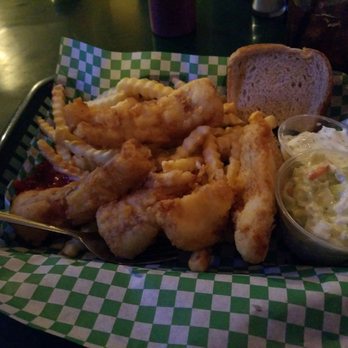
Where is `table`? This screenshot has width=348, height=348. table is located at coordinates (14, 54).